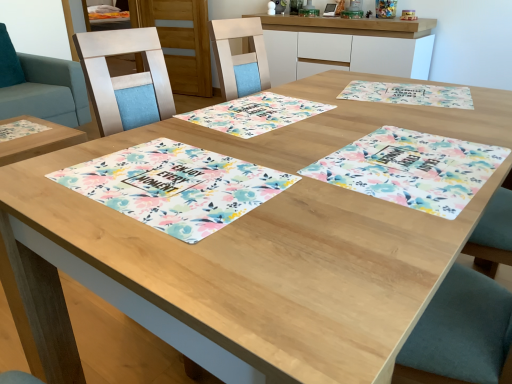
Image resolution: width=512 pixels, height=384 pixels. I want to click on free space to the left of floral fabric placemat at upper right, which is the fourth place mat in left-to-right order, so click(315, 100).